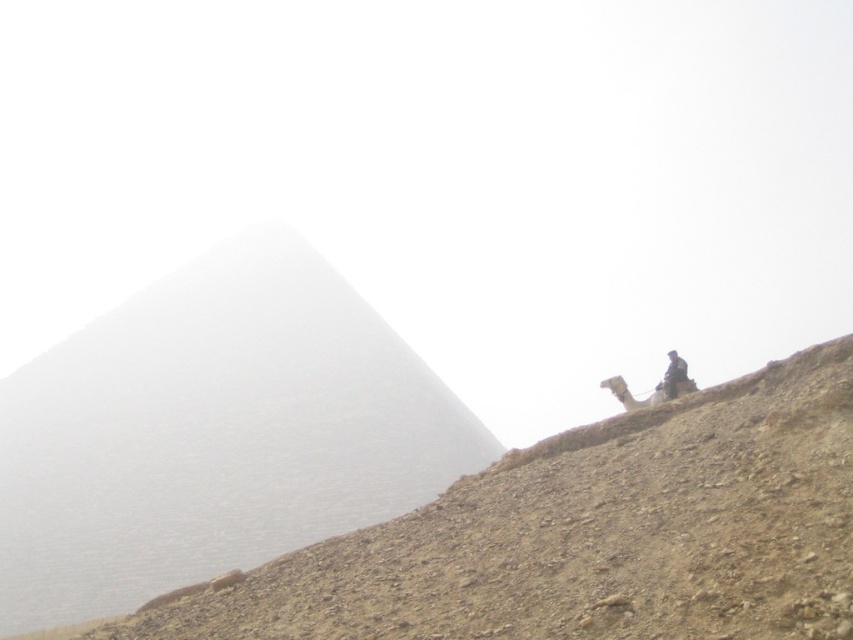
Question: Does gray stone pyramid at upper left appear on the left side of dark brown leather jacket at upper right?

Choices:
 (A) no
 (B) yes

Answer: (B)

Question: Can you confirm if gray stone pyramid at upper left is wider than dark brown leather jacket at upper right?

Choices:
 (A) no
 (B) yes

Answer: (B)

Question: Which point appears closest to the camera in this image?

Choices:
 (A) (676, 352)
 (B) (16, 572)

Answer: (A)

Question: Which point is farther from the camera taking this photo?

Choices:
 (A) (688, 378)
 (B) (228, 465)

Answer: (B)

Question: Is gray stone pyramid at upper left above dark brown leather jacket at upper right?

Choices:
 (A) yes
 (B) no

Answer: (B)